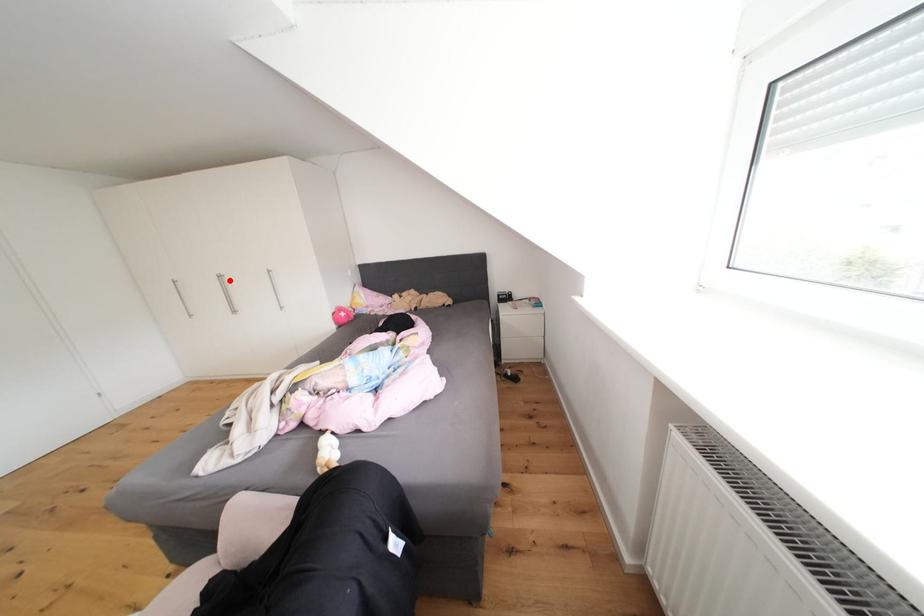
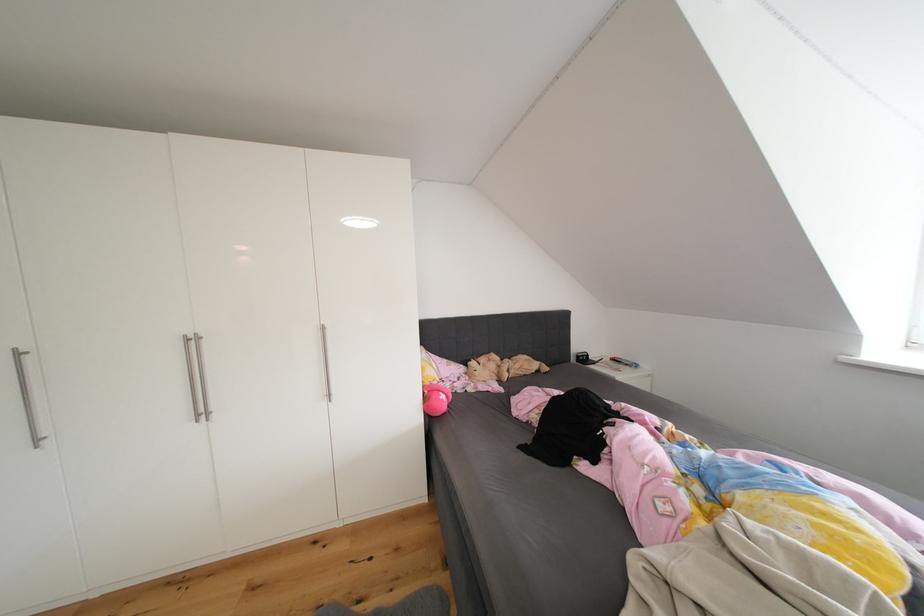
Find the pixel in the second image that matches the highlighted location in the first image.

(201, 344)